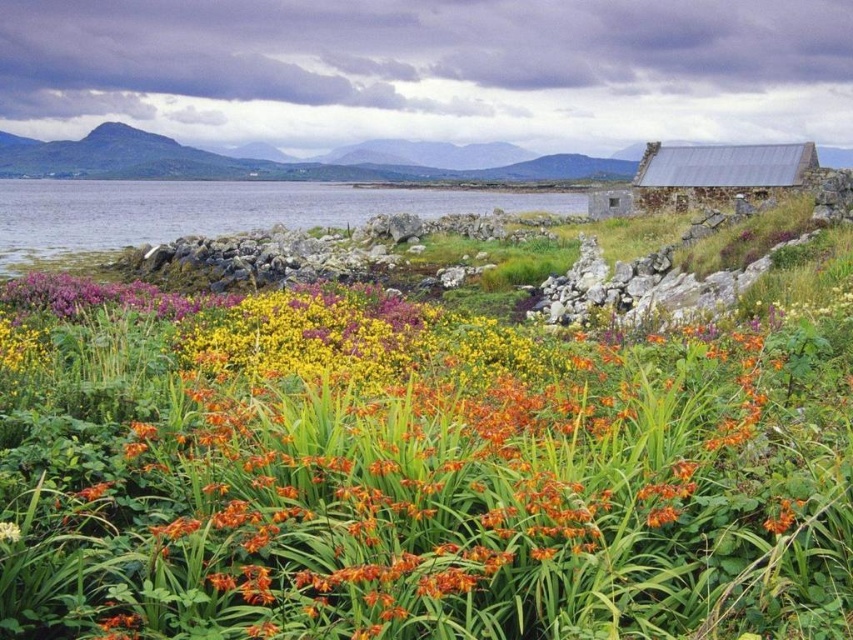
Identify the location of orange grass at center. (410, 474).

This screenshot has height=640, width=853. In order to click on orange grass at center in this screenshot , I will do `click(410, 474)`.

Who is more distant from viewer, (392, 426) or (90, 202)?

Positioned behind is point (90, 202).

Who is higher up, orange grass at center or clear water at center?

clear water at center

Measure the distance between point (73, 518) and camera.

The distance of point (73, 518) from camera is 4.24 meters.

At what (x,y) coordinates should I click in order to perform the action: click on orange grass at center. Please return your answer as a coordinate pair (x, y). Looking at the image, I should click on (410, 474).

Can you confirm if clear water at center is positioned to the right of metallic gray hut at upper right?

No, clear water at center is not to the right of metallic gray hut at upper right.

Which is behind, point (282, 195) or point (730, 161)?

Positioned behind is point (282, 195).

Between point (317, 192) and point (773, 173), which one is positioned behind?

The point (317, 192) is behind.

In order to click on clear water at center in this screenshot , I will do pos(213,211).